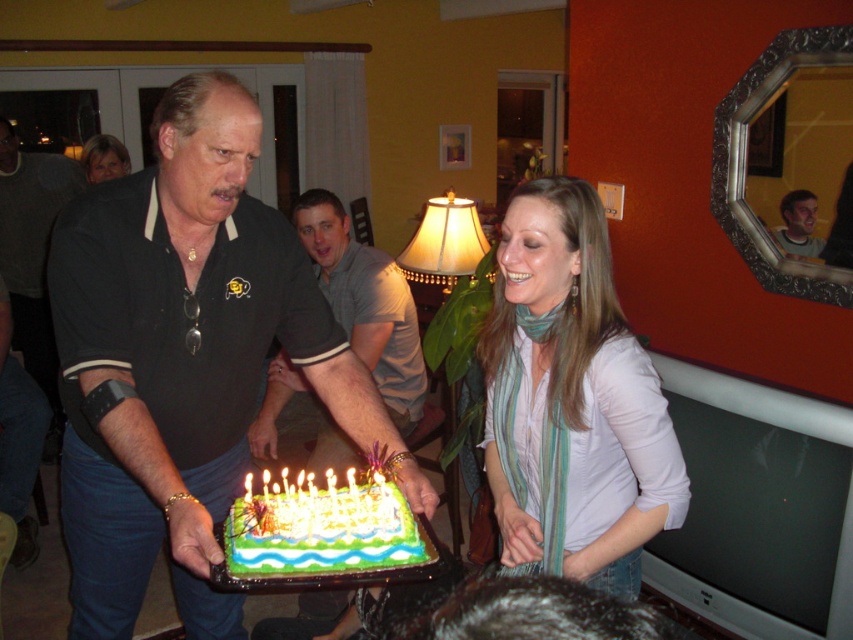
Looking at this image, which is more to the left, light brown hair at upper right or blonde hair at upper left?

blonde hair at upper left is more to the left.

The height and width of the screenshot is (640, 853). What do you see at coordinates (798, 225) in the screenshot? I see `light brown hair at upper right` at bounding box center [798, 225].

Does point (784, 250) lie behind point (120, 173)?

No, it is in front of (120, 173).

Where is `light brown hair at upper right`? The image size is (853, 640). light brown hair at upper right is located at coordinates (798, 225).

Which is in front, point (630, 403) or point (271, 392)?

Point (630, 403)

Is point (520, 308) less distant than point (373, 260)?

Yes.

Does point (653, 404) come in front of point (323, 224)?

Yes, point (653, 404) is in front of point (323, 224).

Image resolution: width=853 pixels, height=640 pixels. Identify the location of white striped scarf at center. (572, 400).

Does point (547, 328) lie behind point (247, 496)?

Yes, point (547, 328) is behind point (247, 496).

This screenshot has height=640, width=853. Describe the element at coordinates (572, 400) in the screenshot. I see `white striped scarf at center` at that location.

Locate an element on the screen. The width and height of the screenshot is (853, 640). white striped scarf at center is located at coordinates (572, 400).